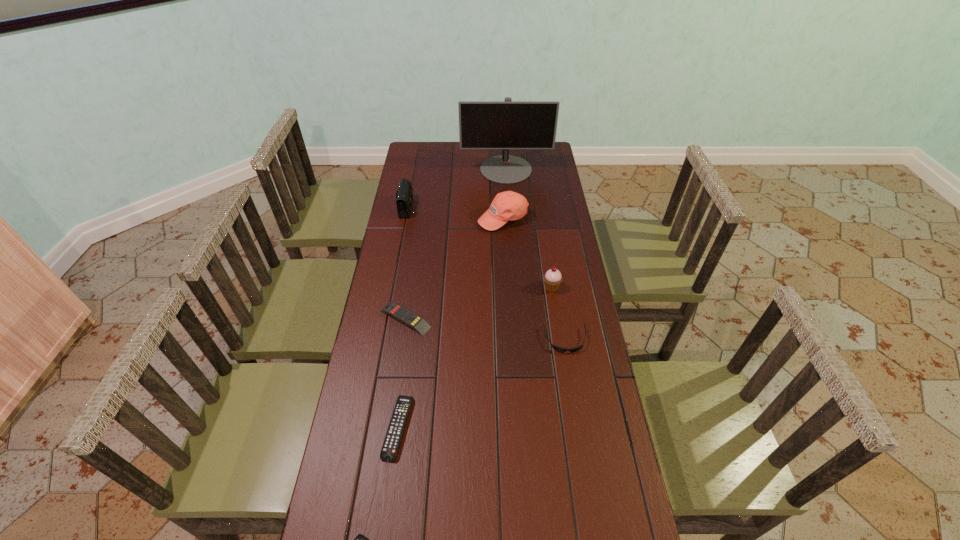
Locate an element on the screen. the farthest object is located at coordinates (507, 124).

Locate an element on the screen. Image resolution: width=960 pixels, height=540 pixels. computer monitor is located at coordinates (507, 124).

This screenshot has height=540, width=960. I want to click on baseball cap, so click(507, 206).

The height and width of the screenshot is (540, 960). What are the coordinates of `clutch bag` in the screenshot? It's located at (404, 197).

You are a GUI agent. You are given a task and a screenshot of the screen. Output one action in this format:
    pyautogui.click(x=<x>, y=<y>)
    Task: Click on the cupcake
    
    Given the screenshot: What is the action you would take?
    pyautogui.click(x=552, y=278)

Locate an element on the screen. yellow remote control is located at coordinates (398, 312).

This screenshot has width=960, height=540. Find the location of `the farthest remote control`. the farthest remote control is located at coordinates (398, 312).

Find the location of a particular element. The width and height of the screenshot is (960, 540). sunglasses is located at coordinates (559, 349).

Locate an element on the screen. Image resolution: width=960 pixels, height=540 pixels. the seventh farthest object is located at coordinates (393, 437).

Locate an element on the screen. the bigger black remote control is located at coordinates (393, 437).